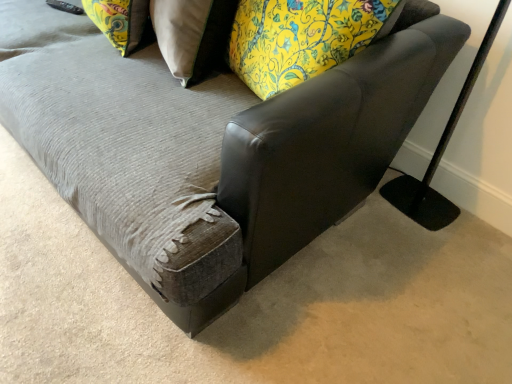
Identify the location of free space in front of black matte table lamp at right. (428, 247).